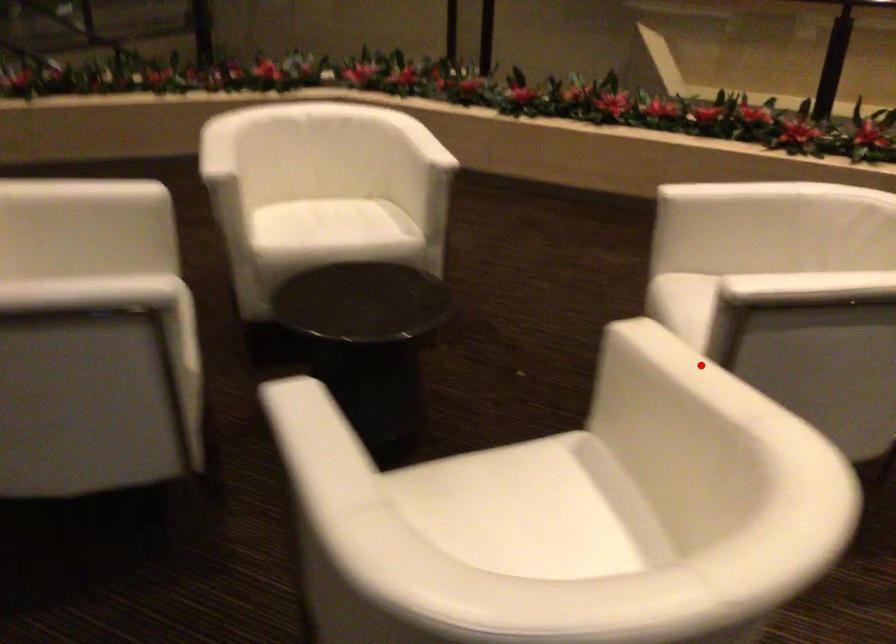
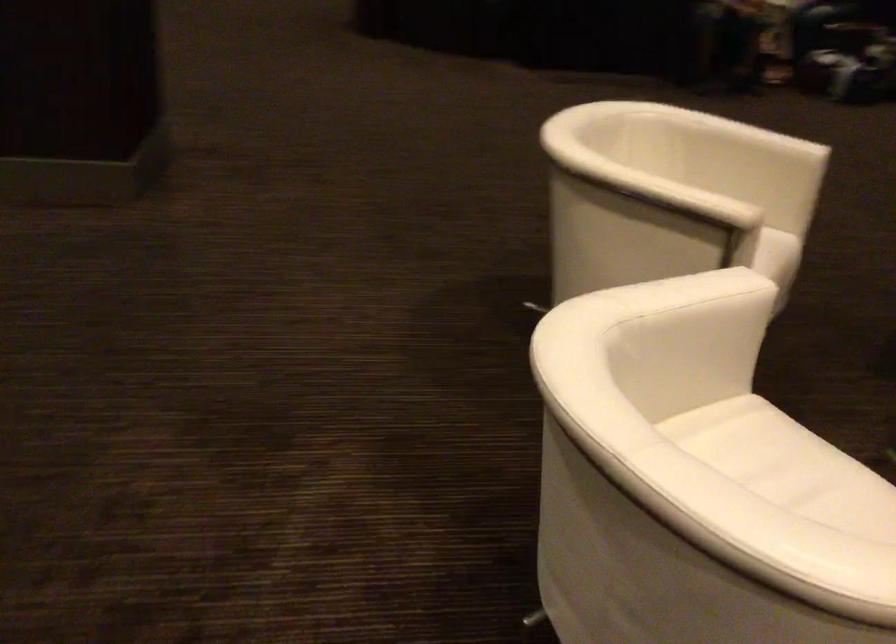
Question: I am providing you with two images of the same scene from different viewpoints. Given a red point in image1, look at the same physical point in image2. Is it:

Choices:
 (A) Closer to the viewpoint
 (B) Farther from the viewpoint

Answer: (B)